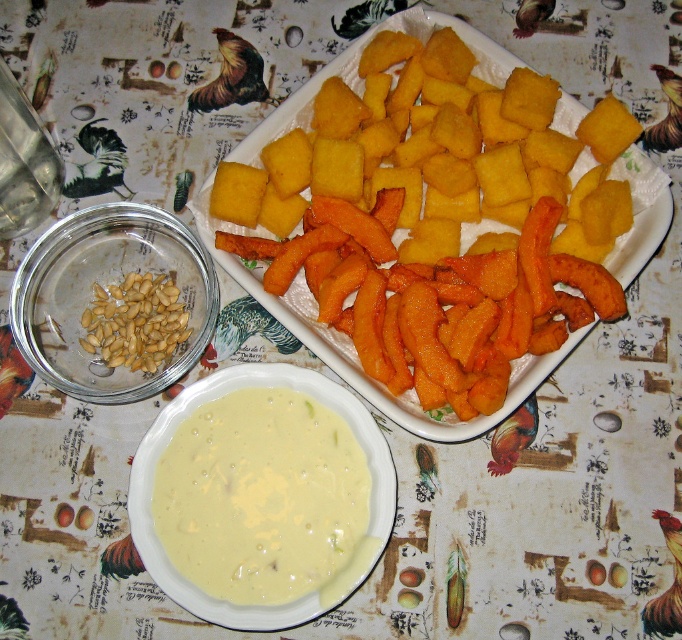
What is the exact coordinate of the yellow fried polenta at center?

The yellow fried polenta at center is located at point [355,349].

You are a food critic evaluating this meal. You notice the yellow fried polenta at center and the golden brown seeds at left. Which item is positioned higher on the table?

The yellow fried polenta at center is located above the golden brown seeds at left, so it is positioned higher on the table.